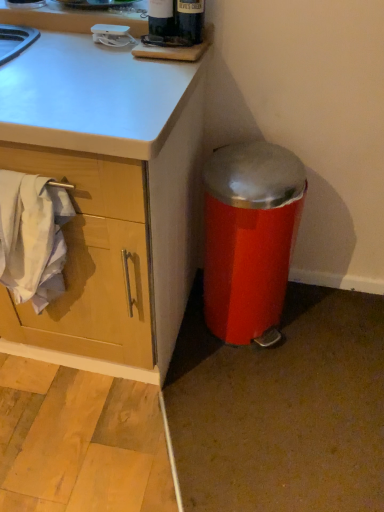
Question: Is white cotton towel at left next to dark glass bottle at upper center?

Choices:
 (A) yes
 (B) no

Answer: (B)

Question: Can you confirm if white cotton towel at left is shorter than dark glass bottle at upper center?

Choices:
 (A) yes
 (B) no

Answer: (B)

Question: Is white cotton towel at left thinner than dark glass bottle at upper center?

Choices:
 (A) no
 (B) yes

Answer: (A)

Question: Considering the relative positions of white cotton towel at left and dark glass bottle at upper center in the image provided, is white cotton towel at left behind dark glass bottle at upper center?

Choices:
 (A) no
 (B) yes

Answer: (A)

Question: Is white cotton towel at left turned away from dark glass bottle at upper center?

Choices:
 (A) no
 (B) yes

Answer: (A)

Question: Can you confirm if white cotton towel at left is taller than dark glass bottle at upper center?

Choices:
 (A) no
 (B) yes

Answer: (B)

Question: Is metallic red trash can at lower right positioned beyond the bounds of dark glass bottle at upper center?

Choices:
 (A) no
 (B) yes

Answer: (B)

Question: Considering the relative sizes of metallic red trash can at lower right and dark glass bottle at upper center in the image provided, is metallic red trash can at lower right wider than dark glass bottle at upper center?

Choices:
 (A) yes
 (B) no

Answer: (A)

Question: From a real-world perspective, does metallic red trash can at lower right stand above dark glass bottle at upper center?

Choices:
 (A) no
 (B) yes

Answer: (A)

Question: Considering the relative positions of metallic red trash can at lower right and dark glass bottle at upper center in the image provided, is metallic red trash can at lower right to the right of dark glass bottle at upper center from the viewer's perspective?

Choices:
 (A) yes
 (B) no

Answer: (A)

Question: From a real-world perspective, is metallic red trash can at lower right under dark glass bottle at upper center?

Choices:
 (A) yes
 (B) no

Answer: (A)

Question: Is metallic red trash can at lower right positioned with its back to dark glass bottle at upper center?

Choices:
 (A) yes
 (B) no

Answer: (B)

Question: Can you confirm if dark glass bottle at upper center is shorter than white cotton towel at left?

Choices:
 (A) yes
 (B) no

Answer: (A)